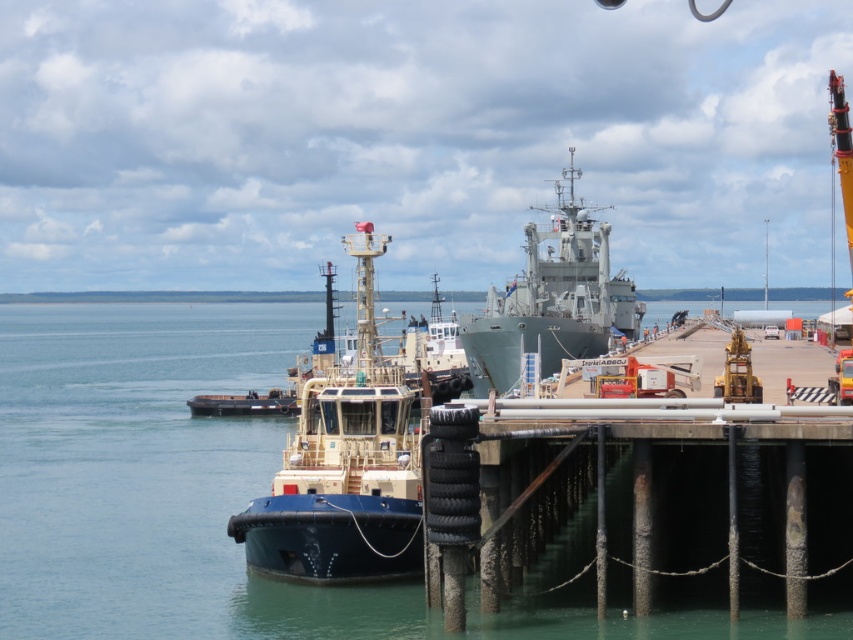
Looking at this image, you are standing on the pier and want to board the blue matte tugboat at center. The safety regulations state that you must maintain a distance of at least 50 meters from any vessel while approaching. Are you currently within the required safety distance?

The distance between you and the blue matte tugboat at center is 42.52 meters, which is less than the required 50 meters. Therefore, you are currently within the required safety distance.

Looking at this image, you are a port authority inspector tasked with ensuring safety protocols are followed. You notice the blue matte tugboat at center and the gray metallic ship at center. According to the maritime safety guidelines, the tugboat must be positioned to the right of the ship to allow safe maneuvering. Is the current positioning compliant with the guidelines?

The blue matte tugboat at center is to the left of gray metallic ship at center, which does not comply with the safety guidelines requiring the tugboat to be positioned to the right of the ship for safe maneuvering.

You are a ship navigator trying to dock your vessel at the port. The blue matte tugboat at center is currently occupying a specific location. Based on the coordinates provided, can you determine if the tugboat is positioned closer to the left or right side of the port area?

The blue matte tugboat at center is located at coordinates point (344, 465), which places it closer to the right side of the port area.